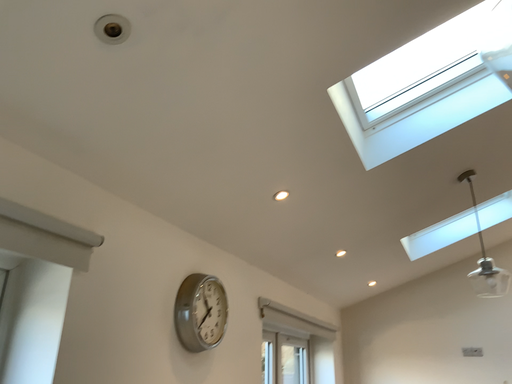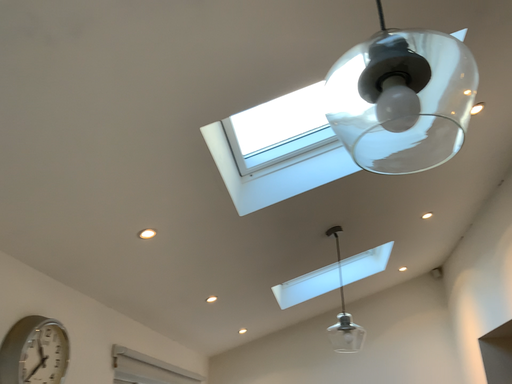
Question: How did the camera likely rotate when shooting the video?

Choices:
 (A) rotated right
 (B) rotated left

Answer: (A)